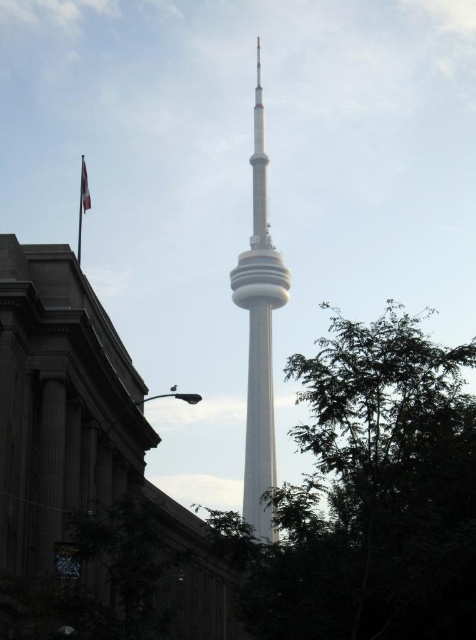
Question: Can you confirm if green leafy tree at center is thinner than white smooth tower at center?

Choices:
 (A) yes
 (B) no

Answer: (B)

Question: Is green leafy tree at center bigger than white smooth tower at center?

Choices:
 (A) no
 (B) yes

Answer: (B)

Question: Can you confirm if white smooth tower at center is positioned to the right of red fabric flag at left?

Choices:
 (A) yes
 (B) no

Answer: (A)

Question: Which of the following is the farthest from the observer?

Choices:
 (A) (263, 180)
 (B) (83, 196)
 (C) (317, 486)

Answer: (A)

Question: Based on their relative distances, which object is farther from the white smooth tower at center?

Choices:
 (A) red fabric flag at left
 (B) green leafy tree at center

Answer: (A)

Question: Among these points, which one is nearest to the camera?

Choices:
 (A) (417, 534)
 (B) (81, 193)
 (C) (251, 296)

Answer: (A)